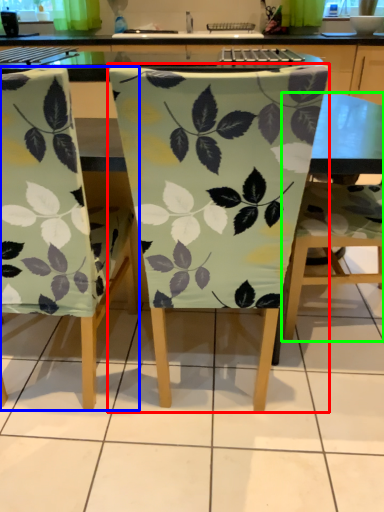
Question: Considering the real-world distances, which object is farthest from chair (highlighted by a red box)? chair (highlighted by a blue box) or chair (highlighted by a green box)?

Choices:
 (A) chair
 (B) chair

Answer: (B)